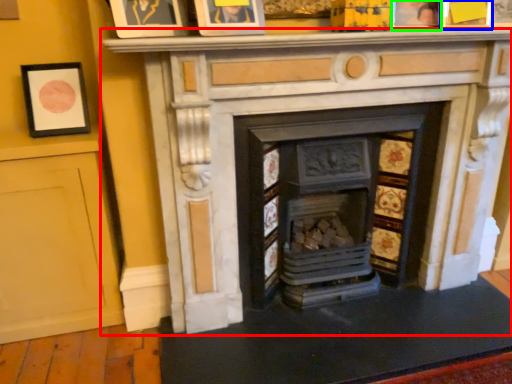
Question: Which is nearer to the fireplace (highlighted by a red box)? picture frame (highlighted by a blue box) or picture frame (highlighted by a green box).

Choices:
 (A) picture frame
 (B) picture frame

Answer: (B)